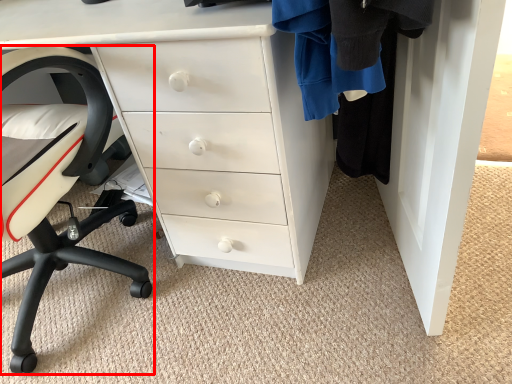
Question: From the image's perspective, what is the correct spatial relationship of chair (annotated by the red box) in relation to chest of drawers?

Choices:
 (A) above
 (B) below

Answer: (B)